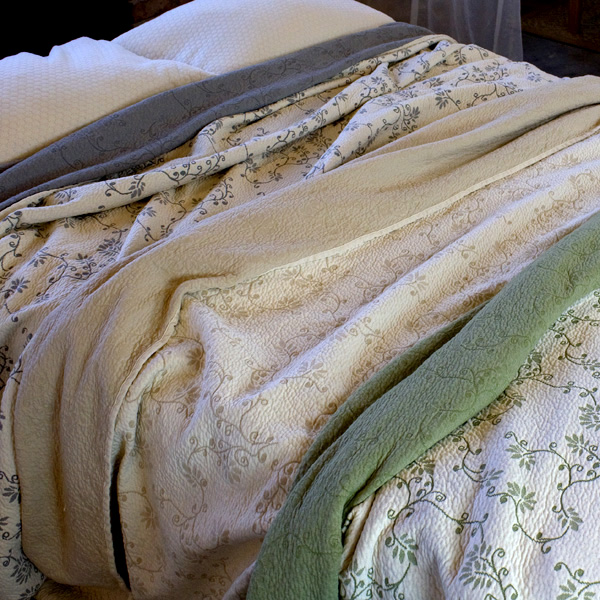
Locate an element on the screen. patterned blanket is located at coordinates (139, 124), (216, 162), (318, 221), (483, 331).